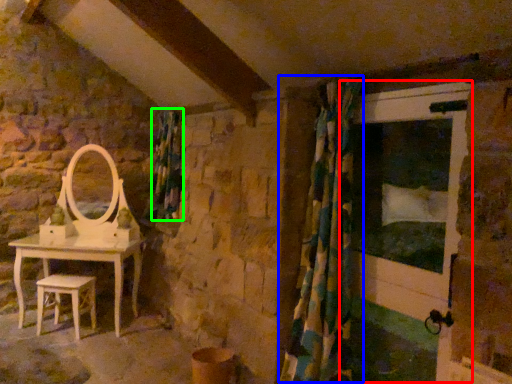
Question: Which object is positioned closest to screen door (highlighted by a red box)? Select from shower curtain (highlighted by a blue box) and curtain (highlighted by a green box).

Choices:
 (A) shower curtain
 (B) curtain

Answer: (A)